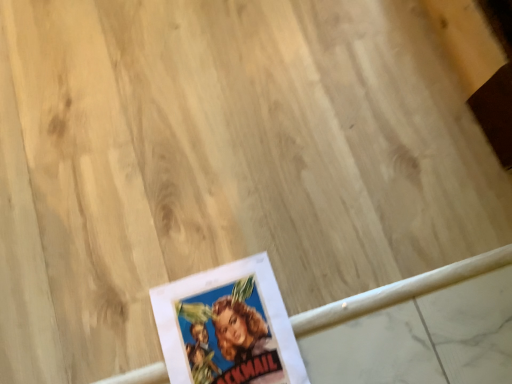
Find the location of `free space above matte paper picture frame at lower center (from a real-world perspective)`. free space above matte paper picture frame at lower center (from a real-world perspective) is located at coordinates (229, 339).